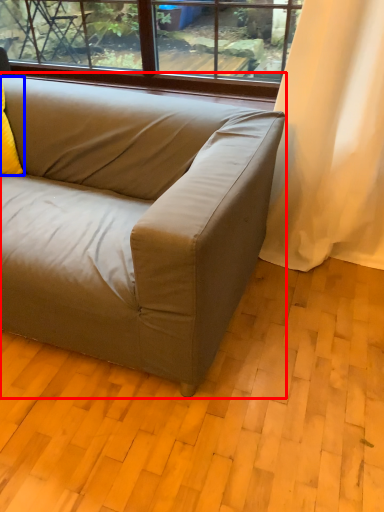
Question: Which object appears closest to the camera in this image, studio couch (highlighted by a red box) or pillow (highlighted by a blue box)?

Choices:
 (A) studio couch
 (B) pillow

Answer: (A)